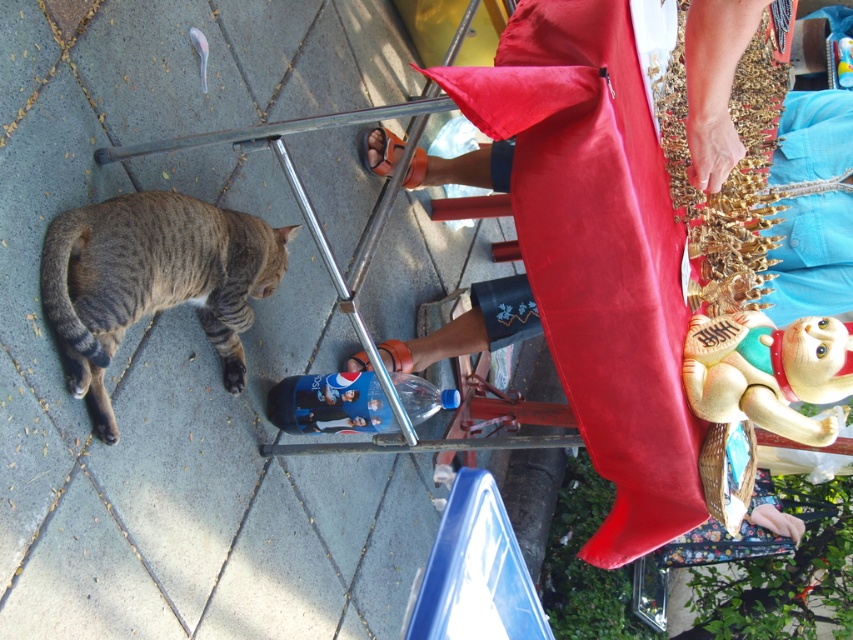
You are a delivery robot trying to navigate to the front door. You see the gray concrete pavement at lower left and the beige rubber cat at lower right. Which object should you avoid to stay on the path towards the front door?

The beige rubber cat at lower right should be avoided because the gray concrete pavement at lower left is in front of it, indicating the path towards the front door is through the pavement.

You are a delivery robot trying to navigate to the metal folding table in the foreground. There is a gray tabby cat at lower left and a gray concrete pavement at lower left in your way. Can you safely pass between them?

The gray concrete pavement at lower left and gray tabby cat at lower left are 14.09 inches apart. Since the robot needs more space to pass, it cannot safely navigate between them.